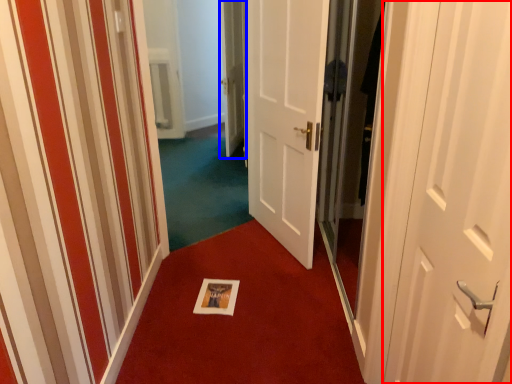
Question: Among these objects, which one is nearest to the camera, door (highlighted by a red box) or door (highlighted by a blue box)?

Choices:
 (A) door
 (B) door

Answer: (A)